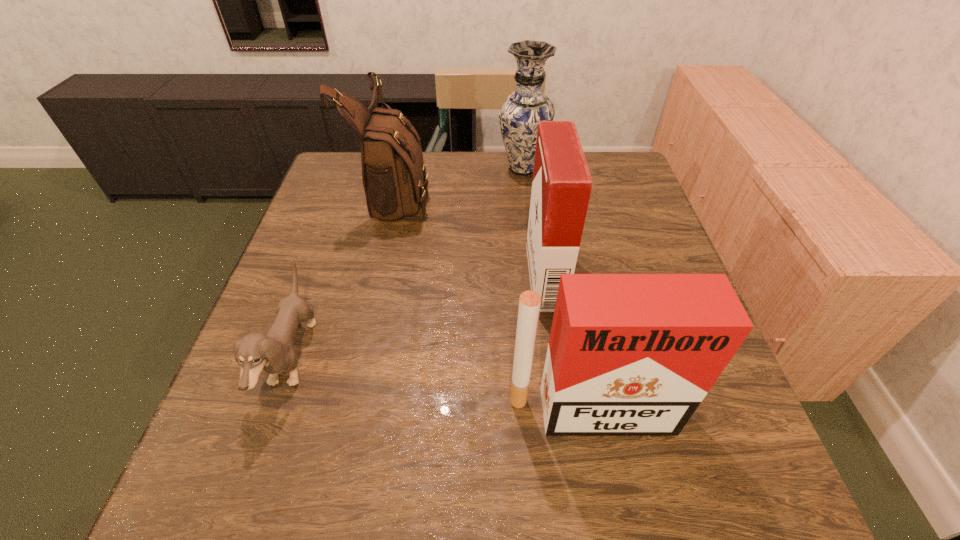
Where is `free spot between the vase and the shortest object`? Image resolution: width=960 pixels, height=540 pixels. free spot between the vase and the shortest object is located at coordinates (407, 264).

Where is `object that can be found as the closest to the nearer cigarette case`? This screenshot has height=540, width=960. object that can be found as the closest to the nearer cigarette case is located at coordinates (561, 187).

Where is `the third closest object relative to the vase`? the third closest object relative to the vase is located at coordinates (273, 353).

The height and width of the screenshot is (540, 960). I want to click on free region that satisfies the following two spatial constraints: 1. on the front side of the vase; 2. on the front-facing side of the shoulder bag, so click(526, 193).